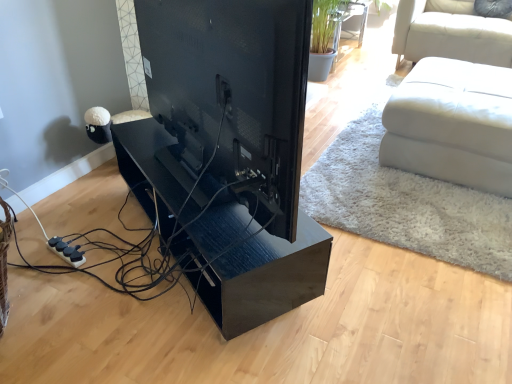
Question: Is there a large distance between glossy wood table at center and black glossy tv at center?

Choices:
 (A) no
 (B) yes

Answer: (A)

Question: Does glossy wood table at center contain black glossy tv at center?

Choices:
 (A) yes
 (B) no

Answer: (B)

Question: Is glossy wood table at center positioned in front of black glossy tv at center?

Choices:
 (A) no
 (B) yes

Answer: (A)

Question: Considering the relative sizes of glossy wood table at center and black glossy tv at center in the image provided, is glossy wood table at center thinner than black glossy tv at center?

Choices:
 (A) no
 (B) yes

Answer: (A)

Question: Is glossy wood table at center oriented away from black glossy tv at center?

Choices:
 (A) yes
 (B) no

Answer: (B)

Question: Is glossy wood table at center smaller than black glossy tv at center?

Choices:
 (A) no
 (B) yes

Answer: (A)

Question: From a real-world perspective, is black glossy tv at center positioned under glossy wood table at center based on gravity?

Choices:
 (A) yes
 (B) no

Answer: (B)

Question: Can you confirm if black glossy tv at center is taller than glossy wood table at center?

Choices:
 (A) no
 (B) yes

Answer: (B)

Question: Is black glossy tv at center shorter than glossy wood table at center?

Choices:
 (A) no
 (B) yes

Answer: (A)

Question: Is glossy wood table at center at the back of black glossy tv at center?

Choices:
 (A) no
 (B) yes

Answer: (A)

Question: Is black glossy tv at center not inside glossy wood table at center?

Choices:
 (A) no
 (B) yes

Answer: (B)

Question: From the image's perspective, would you say black glossy tv at center is positioned over glossy wood table at center?

Choices:
 (A) yes
 (B) no

Answer: (A)

Question: Considering the relative sizes of glossy wood table at center and white leather ottoman at right in the image provided, is glossy wood table at center shorter than white leather ottoman at right?

Choices:
 (A) no
 (B) yes

Answer: (B)